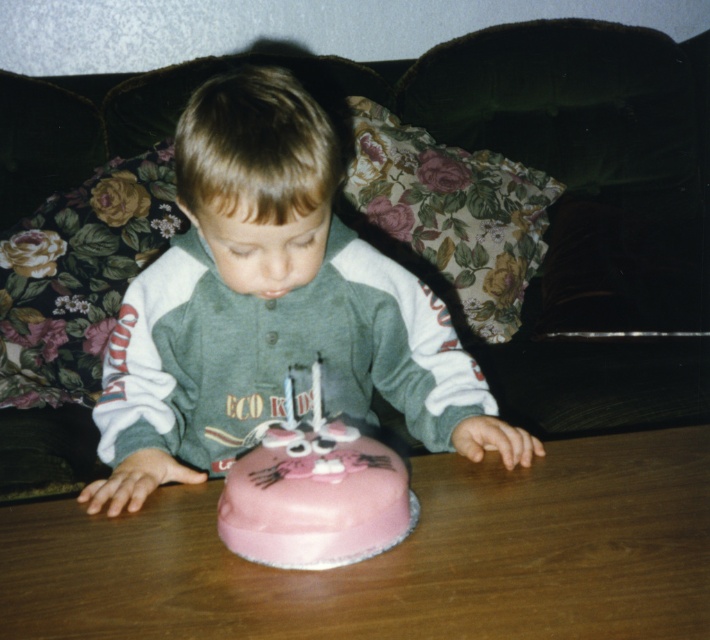
You are a photographer trying to capture a closeup of the cake with the candles lit. You notice a point at coordinates (271,307) in the image. What object is located at this point?

The point at coordinates (271,307) corresponds to the matte green sweatshirt at center.

You are a photographer standing at a distance of 30 inches from the scene. You want to take a closeup shot of the matte green sweatshirt at center without moving the camera. Is the sweatshirt within your camera frame?

The matte green sweatshirt at center is 29.20 inches from the viewer, which is within the photographer standing at 30 inches distance. Therefore, the sweatshirt is within the camera frame.

You are a parent preparing to take a photo of your child with the pink frosted cake at center and the white paper birthday candle at center. To ensure the cake is the main focus, which object should you position closer to the camera?

The pink frosted cake at center should be positioned closer to the camera since it is taller than the white paper birthday candle at center, making it naturally stand out more in the photo.